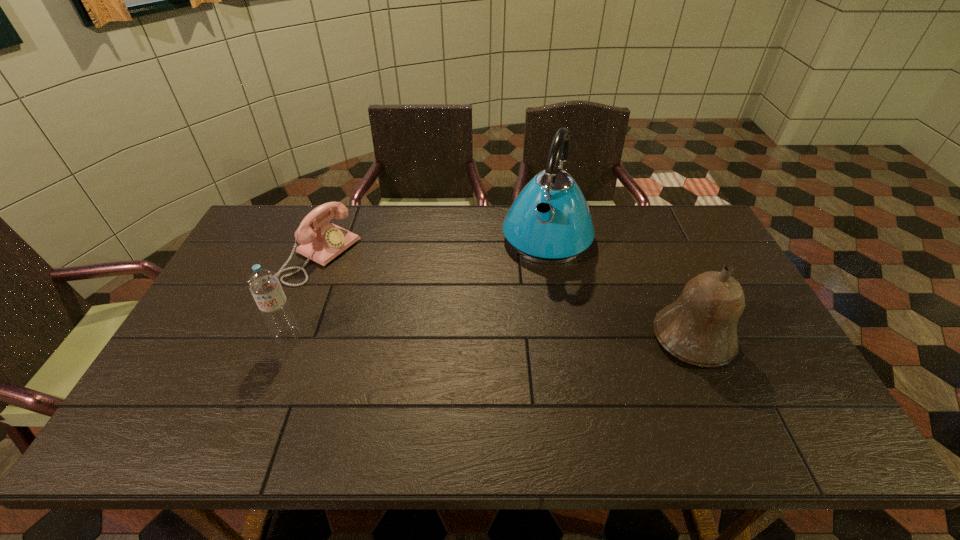
I want to click on free spot on the desktop that is between the water bottle and the bell and is positioned on the dial of the shortest object, so click(x=482, y=337).

Locate an element on the screen. free space on the desktop that is between the water bottle and the bell and is positioned at the spout of the tallest object is located at coordinates (507, 337).